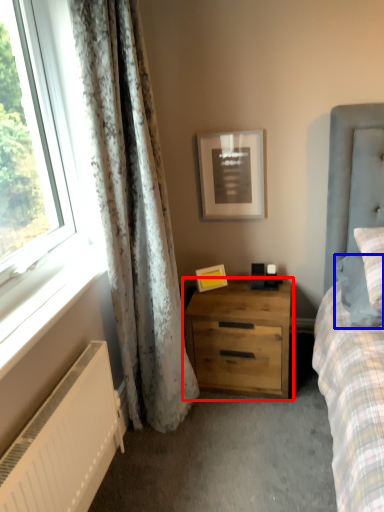
Question: Which object appears farthest to the camera in this image, nightstand (highlighted by a red box) or pillow (highlighted by a blue box)?

Choices:
 (A) nightstand
 (B) pillow

Answer: (A)